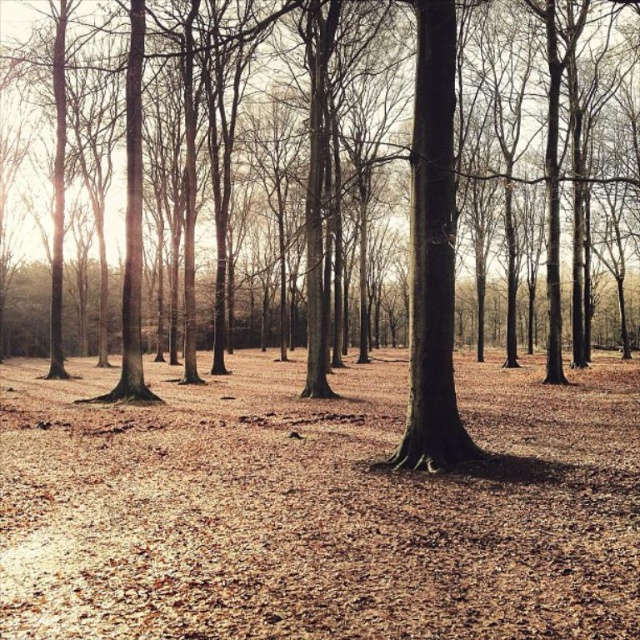
Can you confirm if brown leafy ground at center is positioned to the left of brown matte tree trunk at center?

Incorrect, brown leafy ground at center is not on the left side of brown matte tree trunk at center.

Which is more to the right, brown leafy ground at center or brown matte tree trunk at center?

brown leafy ground at center

Is point (332, 515) more distant than point (13, 204)?

No, (332, 515) is closer to viewer.

I want to click on brown leafy ground at center, so click(316, 506).